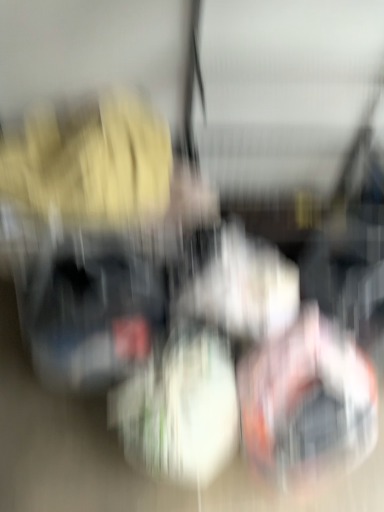
The image size is (384, 512). What do you see at coordinates (307, 400) in the screenshot?
I see `orange fabric shoe at center` at bounding box center [307, 400].

Find the location of `orange fabric shoe at center`. orange fabric shoe at center is located at coordinates (307, 400).

The image size is (384, 512). Identify the location of orange fabric shoe at center. (307, 400).